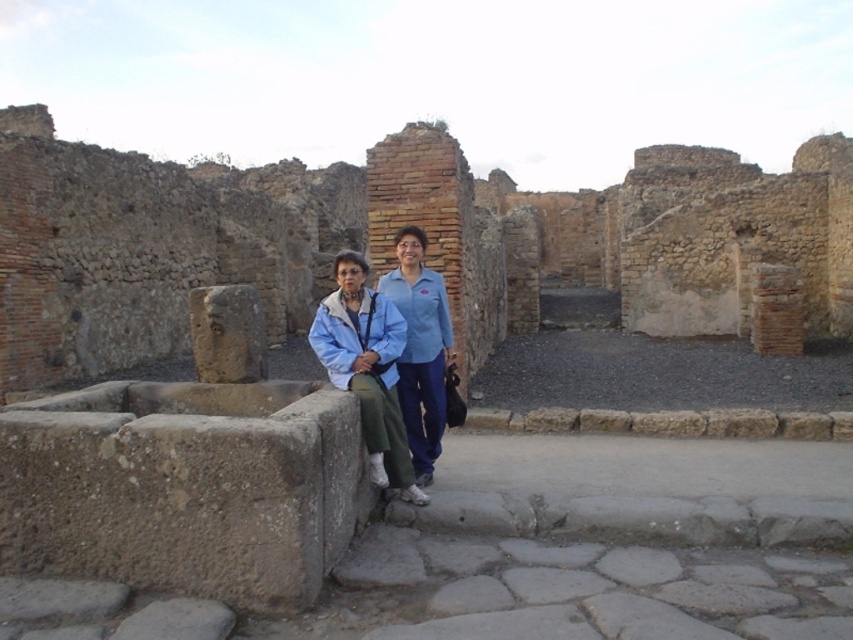
Which is more to the left, brick wall at center or blue fabric jacket at center?

brick wall at center

Is point (637, 202) farther from viewer compared to point (402, 476)?

Yes, point (637, 202) is farther from viewer.

Describe the element at coordinates (370, 237) in the screenshot. I see `brick wall at center` at that location.

At what (x,y) coordinates should I click in order to perform the action: click on brick wall at center. Please return your answer as a coordinate pair (x, y). The width and height of the screenshot is (853, 640). Looking at the image, I should click on (370, 237).